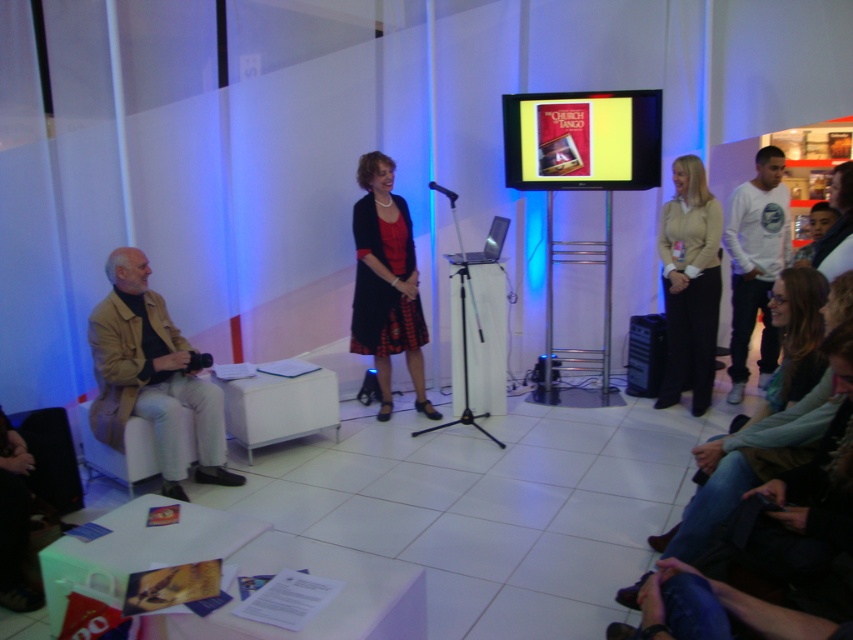
You are attending a presentation and need to hand a document to the person wearing the beige fabric pants at right and the matte black jacket at lower left. Which one is closer to you so you can approach them first?

The beige fabric pants at right is closer to you since it is further to the viewer than the matte black jacket at lower left, meaning the person wearing the beige fabric pants at right is nearer in the frame.

You are a photographer standing at the back of the room. You need to take a photo that includes both the matte black dress at center and the white cotton shirt at right. The camera you are using has a maximum focus range of 2 meters. Will you be able to capture both subjects in focus without moving closer?

The distance between the matte black dress at center and the white cotton shirt at right is 2.13 meters. Since the camera can only focus up to 2 meters, the subjects are slightly out of the focus range. Therefore, you won that be able to capture both in focus without moving closer.